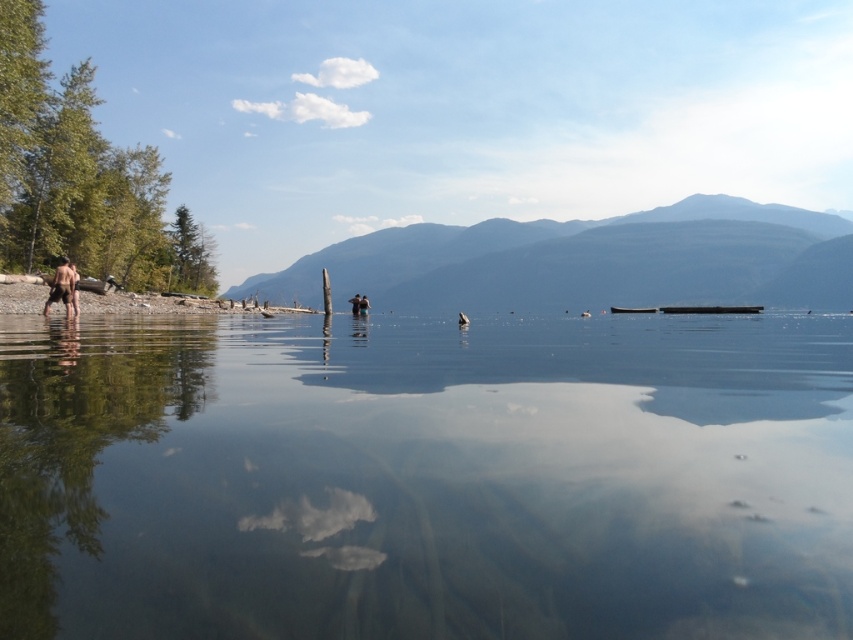
Question: Is brown wood at left positioned behind brown skin at left?

Choices:
 (A) no
 (B) yes

Answer: (B)

Question: Which object is the closest to the brown skin at left?

Choices:
 (A) smooth skin person at center
 (B) clear water at center
 (C) brown wood at left

Answer: (C)

Question: Among these points, which one is farthest from the camera?

Choices:
 (A) (364, 305)
 (B) (15, 301)
 (C) (279, 620)
 (D) (67, 282)

Answer: (A)

Question: Does clear water at center appear on the left side of smooth skin person at center?

Choices:
 (A) no
 (B) yes

Answer: (A)

Question: Is brown wood at left bigger than smooth skin person at center?

Choices:
 (A) no
 (B) yes

Answer: (B)

Question: Which of these objects is positioned farthest from the brown skin at left?

Choices:
 (A) smooth skin person at center
 (B) clear water at center

Answer: (A)